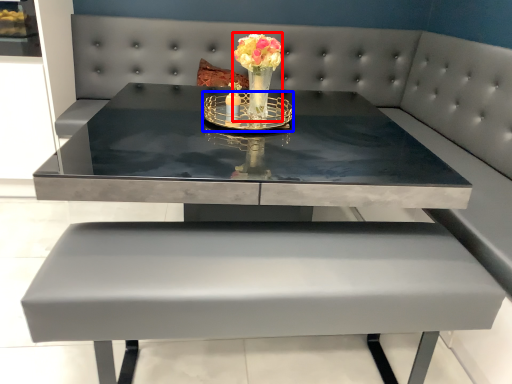
Question: Which point is further to the camera, floral arrangement (highlighted by a red box) or candle holder (highlighted by a blue box)?

Choices:
 (A) floral arrangement
 (B) candle holder

Answer: (B)